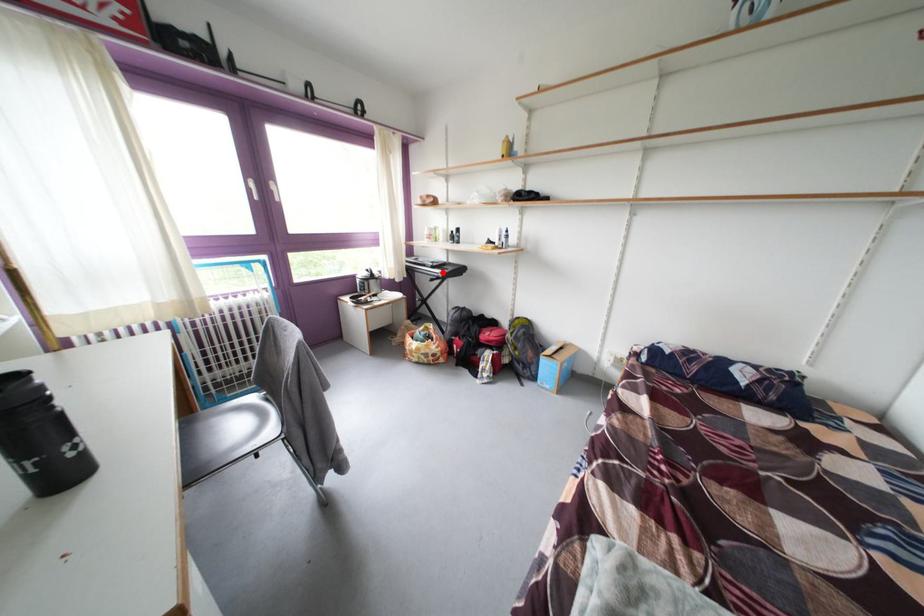
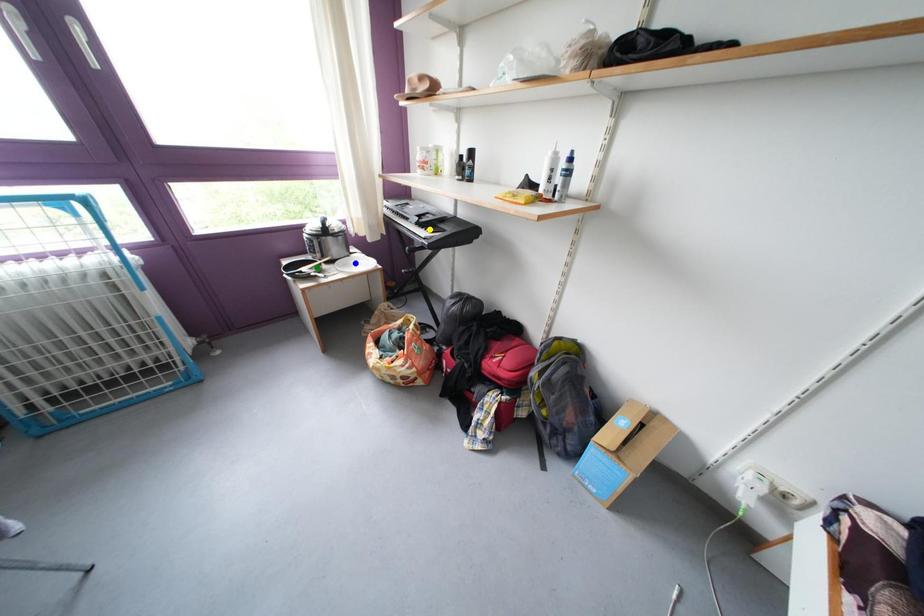
Question: I am providing you with two images of the same scene from different viewpoints. A red point is marked on the first image. You are given multiple points on the second image. Which point in image 2 is actually the same real-world point as the red point in image 1?

Choices:
 (A) green point
 (B) blue point
 (C) yellow point

Answer: (C)